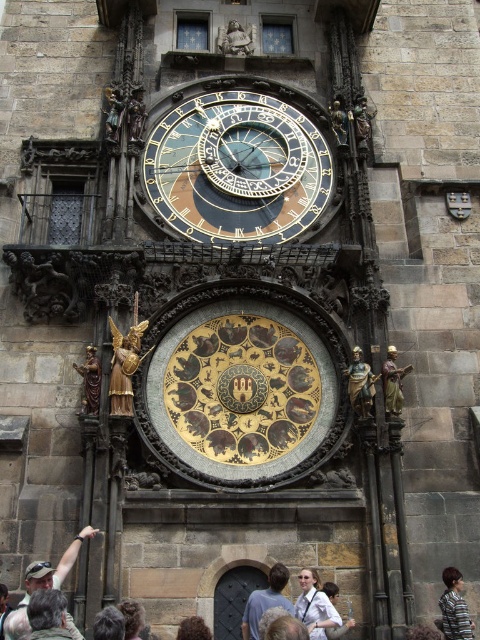
You are an artist standing in front of the historic astronomical clock. You notice a light brown leather jacket at center and a bronze statue at center. Which object is shorter?

The light brown leather jacket at center is shorter than the bronze statue at center.